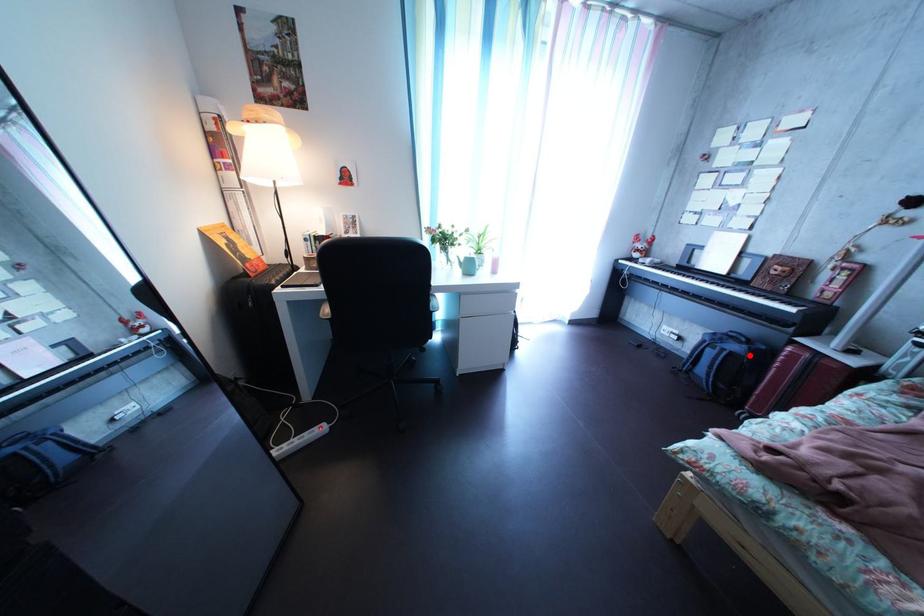
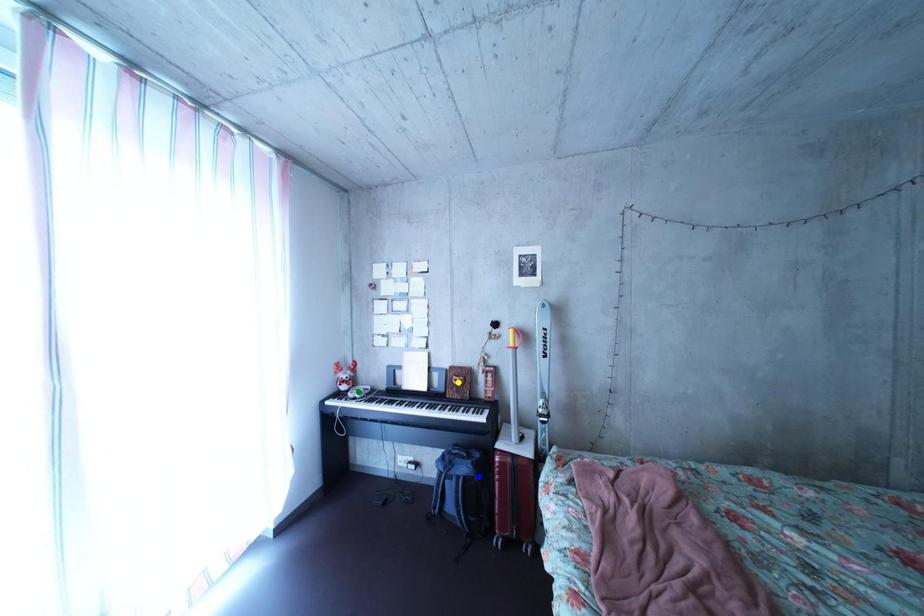
Question: I am providing you with two images of the same scene from different viewpoints. A red point is marked on the first image. You are given multiple points on the second image. Can you choose the point in image 2 that corresponds to the point in image 1?

Choices:
 (A) yellow point
 (B) green point
 (C) blue point

Answer: (C)